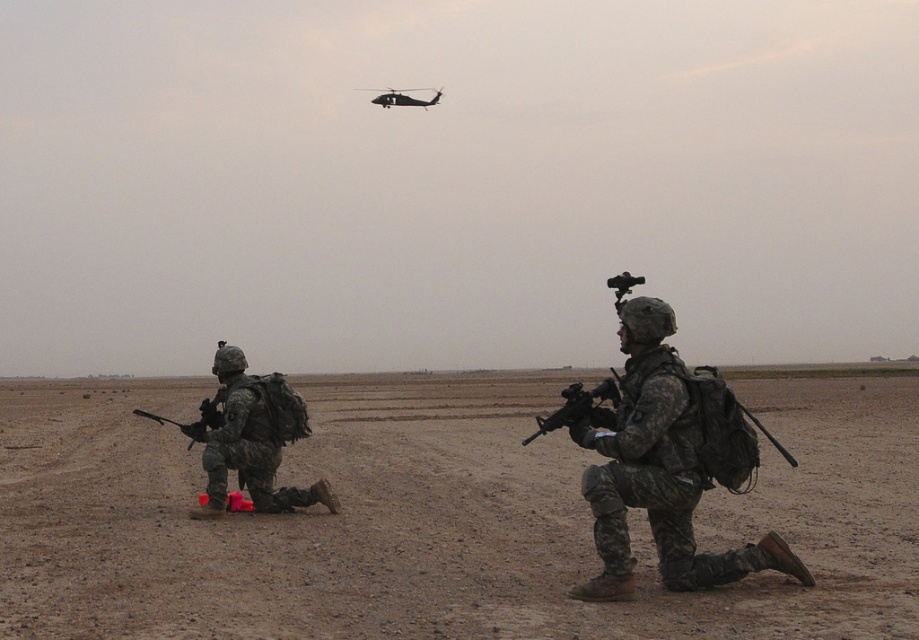
Can you confirm if dull brown dirt at center is smaller than camouflage fabric uniform at center?

Actually, dull brown dirt at center might be larger than camouflage fabric uniform at center.

I want to click on dull brown dirt at center, so click(x=437, y=516).

Image resolution: width=919 pixels, height=640 pixels. In order to click on dull brown dirt at center in this screenshot , I will do `click(437, 516)`.

Between point (353, 588) and point (146, 417), which one is positioned in front?

Point (353, 588)

Does dull brown dirt at center have a greater height compared to matte black rifle at left?

Yes, dull brown dirt at center is taller than matte black rifle at left.

Is point (388, 388) in front of point (153, 416)?

No, (388, 388) is behind (153, 416).

This screenshot has height=640, width=919. What are the coordinates of `dull brown dirt at center` in the screenshot? It's located at (437, 516).

Is camouflage fabric uniform at center smaller than matte black rifle at center?

Indeed, camouflage fabric uniform at center has a smaller size compared to matte black rifle at center.

Who is shorter, camouflage fabric uniform at center or matte black rifle at center?

camouflage fabric uniform at center

Find the location of a particular element. The image size is (919, 640). camouflage fabric uniform at center is located at coordinates 668,465.